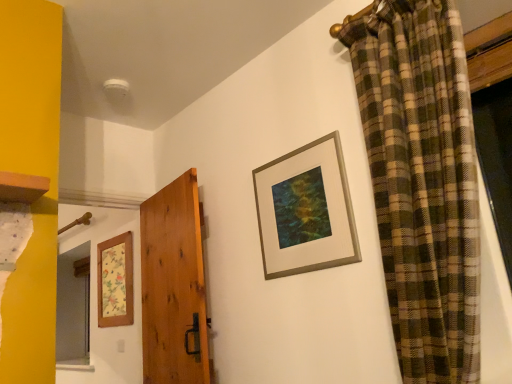
Question: Is wooden floral-patterned picture frame at left, the 1th picture frame positioned from the back, shorter than gold metallic picture frame at upper center, which is the 1th picture frame from top to bottom?

Choices:
 (A) yes
 (B) no

Answer: (B)

Question: Does wooden floral-patterned picture frame at left, the 1th picture frame positioned from the bottom, appear on the right side of gold metallic picture frame at upper center, marked as the 1th picture frame in a right-to-left arrangement?

Choices:
 (A) yes
 (B) no

Answer: (B)

Question: Would you consider wooden floral-patterned picture frame at left, the second picture frame in the front-to-back sequence, to be distant from gold metallic picture frame at upper center, acting as the first picture frame starting from the front?

Choices:
 (A) yes
 (B) no

Answer: (A)

Question: Is wooden floral-patterned picture frame at left, the 1th picture frame positioned from the bottom, touching gold metallic picture frame at upper center, placed as the 2th picture frame when sorted from back to front?

Choices:
 (A) no
 (B) yes

Answer: (A)

Question: Can you confirm if wooden floral-patterned picture frame at left, the second picture frame in the front-to-back sequence, is taller than gold metallic picture frame at upper center, the 2th picture frame positioned from the bottom?

Choices:
 (A) no
 (B) yes

Answer: (B)

Question: From the image's perspective, does wooden floral-patterned picture frame at left, the 1th picture frame positioned from the back, appear higher than gold metallic picture frame at upper center, the 2th picture frame from the left?

Choices:
 (A) no
 (B) yes

Answer: (A)

Question: Does natural wood door at center come in front of gold metallic picture frame at upper center, the 2th picture frame from the left?

Choices:
 (A) no
 (B) yes

Answer: (A)

Question: Can gold metallic picture frame at upper center, the 2th picture frame positioned from the bottom, be found inside natural wood door at center?

Choices:
 (A) no
 (B) yes

Answer: (A)

Question: Can you confirm if natural wood door at center is thinner than gold metallic picture frame at upper center, marked as the 1th picture frame in a right-to-left arrangement?

Choices:
 (A) yes
 (B) no

Answer: (B)

Question: From the image's perspective, does natural wood door at center appear lower than gold metallic picture frame at upper center, the 2th picture frame positioned from the bottom?

Choices:
 (A) no
 (B) yes

Answer: (B)

Question: Is natural wood door at center further to camera compared to gold metallic picture frame at upper center, acting as the first picture frame starting from the front?

Choices:
 (A) yes
 (B) no

Answer: (A)

Question: Could you tell me if natural wood door at center is turned towards gold metallic picture frame at upper center, placed as the 2th picture frame when sorted from back to front?

Choices:
 (A) no
 (B) yes

Answer: (A)

Question: From a real-world perspective, is natural wood door at center over wooden floral-patterned picture frame at left, the 1th picture frame positioned from the back?

Choices:
 (A) yes
 (B) no

Answer: (B)